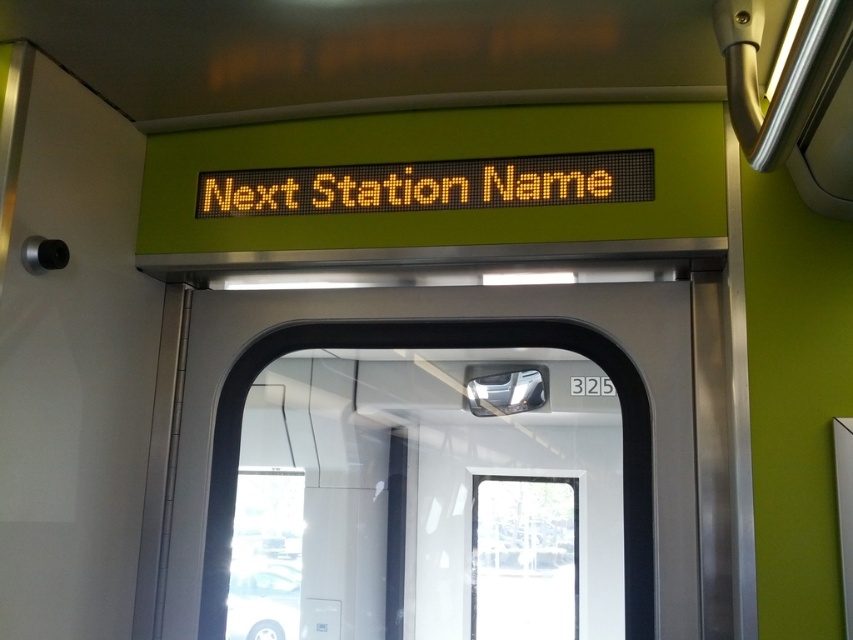
Can you confirm if metallic silver door at center is bigger than yellow led display at upper center?

Yes.

Identify the location of metallic silver door at center. (456, 317).